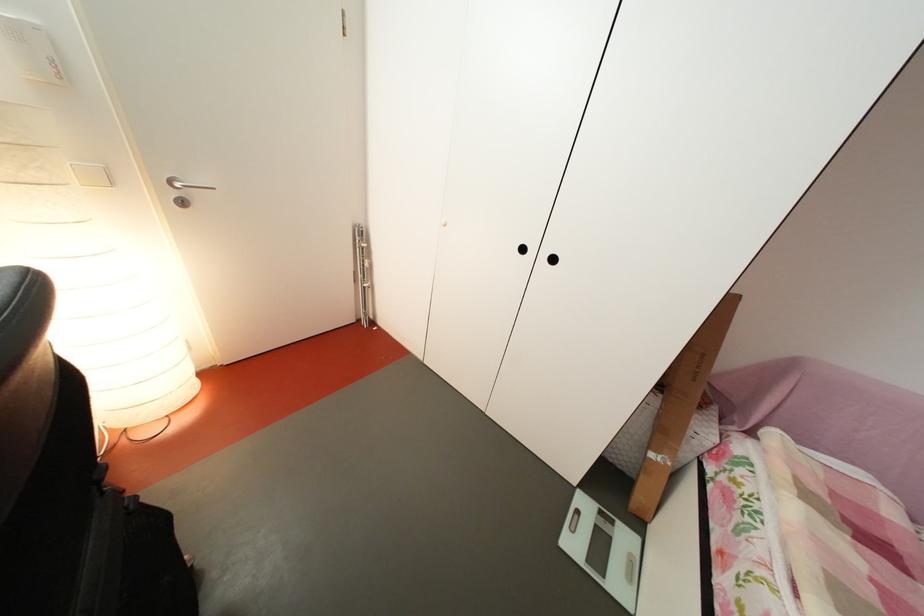
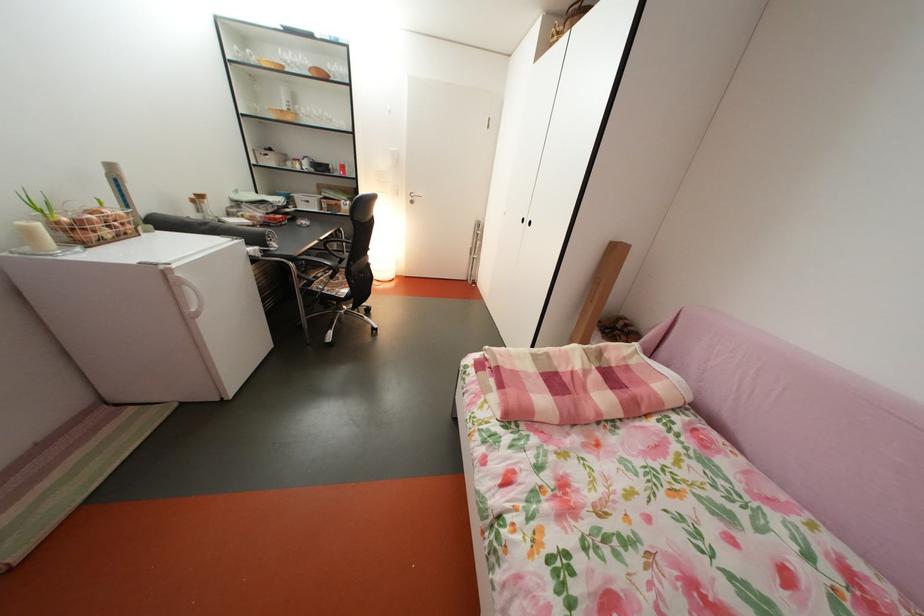
In the second image, find the point that corresponds to the point at 859,544 in the first image.

(604, 374)